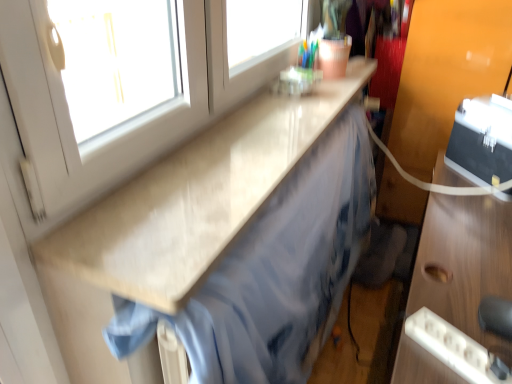
Question: From a real-world perspective, is wooden desk at right above or below light beige laminate countertop at upper center?

Choices:
 (A) below
 (B) above

Answer: (A)

Question: From the image's perspective, is wooden desk at right positioned above or below light beige laminate countertop at upper center?

Choices:
 (A) below
 (B) above

Answer: (A)

Question: Is wooden desk at right taller or shorter than light beige laminate countertop at upper center?

Choices:
 (A) short
 (B) tall

Answer: (B)

Question: From a real-world perspective, is light beige laminate countertop at upper center above or below wooden desk at right?

Choices:
 (A) below
 (B) above

Answer: (B)

Question: Is point (208, 152) closer or farther from the camera than point (432, 249)?

Choices:
 (A) closer
 (B) farther

Answer: (A)

Question: In terms of height, does light beige laminate countertop at upper center look taller or shorter compared to wooden desk at right?

Choices:
 (A) short
 (B) tall

Answer: (A)

Question: In the image, is light beige laminate countertop at upper center positioned in front of or behind wooden desk at right?

Choices:
 (A) front
 (B) behind

Answer: (B)